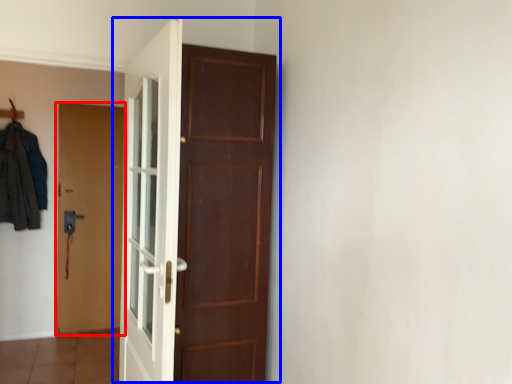
Question: Which object is closer to the camera taking this photo, door (highlighted by a red box) or door (highlighted by a blue box)?

Choices:
 (A) door
 (B) door

Answer: (B)